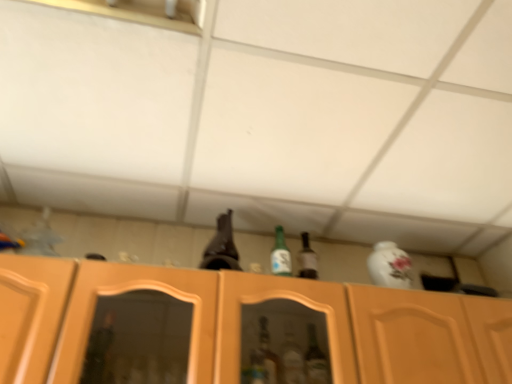
Question: Can you confirm if green glass bottle at center is taller than brown glass beer bottle at upper center?

Choices:
 (A) no
 (B) yes

Answer: (A)

Question: Is green glass bottle at center surrounding brown glass beer bottle at upper center?

Choices:
 (A) no
 (B) yes

Answer: (A)

Question: Does green glass bottle at center lie in front of brown glass beer bottle at upper center?

Choices:
 (A) no
 (B) yes

Answer: (A)

Question: Is green glass bottle at center to the left of brown glass beer bottle at upper center from the viewer's perspective?

Choices:
 (A) no
 (B) yes

Answer: (A)

Question: Is green glass bottle at center oriented towards brown glass beer bottle at upper center?

Choices:
 (A) no
 (B) yes

Answer: (A)

Question: Is green glass bottle at center in front of or behind wooden cabinet at center in the image?

Choices:
 (A) front
 (B) behind

Answer: (B)

Question: From the image's perspective, is green glass bottle at center positioned above or below wooden cabinet at center?

Choices:
 (A) above
 (B) below

Answer: (A)

Question: Is green glass bottle at center situated inside wooden cabinet at center or outside?

Choices:
 (A) inside
 (B) outside

Answer: (B)

Question: From a real-world perspective, is green glass bottle at center physically located above or below wooden cabinet at center?

Choices:
 (A) above
 (B) below

Answer: (A)

Question: Considering their positions, is wooden cabinet at center located in front of or behind green glass bottle at center?

Choices:
 (A) behind
 (B) front

Answer: (B)

Question: In terms of size, does wooden cabinet at center appear bigger or smaller than green glass bottle at center?

Choices:
 (A) big
 (B) small

Answer: (A)

Question: From a real-world perspective, is wooden cabinet at center positioned above or below green glass bottle at center?

Choices:
 (A) above
 (B) below

Answer: (B)

Question: Is wooden cabinet at center inside the boundaries of green glass bottle at center, or outside?

Choices:
 (A) outside
 (B) inside

Answer: (A)

Question: In terms of height, does green glass bottle at center look taller or shorter compared to brown glass beer bottle at upper center?

Choices:
 (A) tall
 (B) short

Answer: (B)

Question: Considering the relative positions of green glass bottle at center and brown glass beer bottle at upper center in the image provided, is green glass bottle at center to the left or to the right of brown glass beer bottle at upper center?

Choices:
 (A) left
 (B) right

Answer: (B)